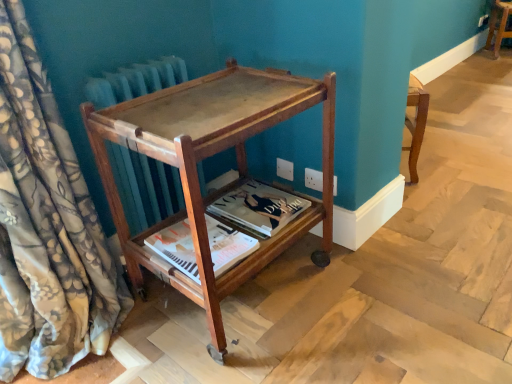
Question: Is matte paper magazine at center, which is the 2th magazine from back to front, not inside matte paper magazine at center, positioned as the 2th magazine in front-to-back order?

Choices:
 (A) no
 (B) yes

Answer: (B)

Question: Is matte paper magazine at center, positioned as the 2th magazine in front-to-back order, completely or partially inside matte paper magazine at center, which is counted as the 1th magazine, starting from the front?

Choices:
 (A) no
 (B) yes

Answer: (A)

Question: Is matte paper magazine at center, which is the 2th magazine from back to front, to the left of matte paper magazine at center, which is the 1th magazine from back to front, from the viewer's perspective?

Choices:
 (A) no
 (B) yes

Answer: (B)

Question: From a real-world perspective, is matte paper magazine at center, which is counted as the 1th magazine, starting from the front, located higher than matte paper magazine at center, positioned as the 2th magazine in front-to-back order?

Choices:
 (A) no
 (B) yes

Answer: (B)

Question: Considering the relative sizes of matte paper magazine at center, which is the 2th magazine from back to front, and matte paper magazine at center, which is the 1th magazine from back to front, in the image provided, is matte paper magazine at center, which is the 2th magazine from back to front, shorter than matte paper magazine at center, which is the 1th magazine from back to front,?

Choices:
 (A) no
 (B) yes

Answer: (B)

Question: Is matte paper magazine at center, which is the 2th magazine from back to front, taller than matte paper magazine at center, which is the 1th magazine from back to front?

Choices:
 (A) no
 (B) yes

Answer: (A)

Question: Is wooden stool at center, arranged as the first furniture when viewed from the back, behind mahogany wood side table at center, arranged as the 2th furniture when viewed from the top?

Choices:
 (A) yes
 (B) no

Answer: (A)

Question: Considering the relative sizes of wooden stool at center, the 2th furniture from the front, and mahogany wood side table at center, arranged as the 2th furniture when viewed from the top, in the image provided, is wooden stool at center, the 2th furniture from the front, shorter than mahogany wood side table at center, arranged as the 2th furniture when viewed from the top,?

Choices:
 (A) yes
 (B) no

Answer: (A)

Question: Can you confirm if wooden stool at center, the 2th furniture from the front, is taller than mahogany wood side table at center, arranged as the 2th furniture when viewed from the top?

Choices:
 (A) no
 (B) yes

Answer: (A)

Question: From the image's perspective, is wooden stool at center, which ranks as the first furniture in right-to-left order, beneath mahogany wood side table at center, the 2th furniture in the right-to-left sequence?

Choices:
 (A) no
 (B) yes

Answer: (A)

Question: Is wooden stool at center, arranged as the first furniture when viewed from the back, far from mahogany wood side table at center, the 2th furniture positioned from the back?

Choices:
 (A) no
 (B) yes

Answer: (B)

Question: Is wooden stool at center, which ranks as the first furniture in right-to-left order, touching mahogany wood side table at center, which appears as the 1th furniture when viewed from the left?

Choices:
 (A) yes
 (B) no

Answer: (B)

Question: Considering the relative sizes of matte paper magazine at center, which is the 2th magazine from back to front, and floral silk curtain at left in the image provided, is matte paper magazine at center, which is the 2th magazine from back to front, shorter than floral silk curtain at left?

Choices:
 (A) yes
 (B) no

Answer: (A)